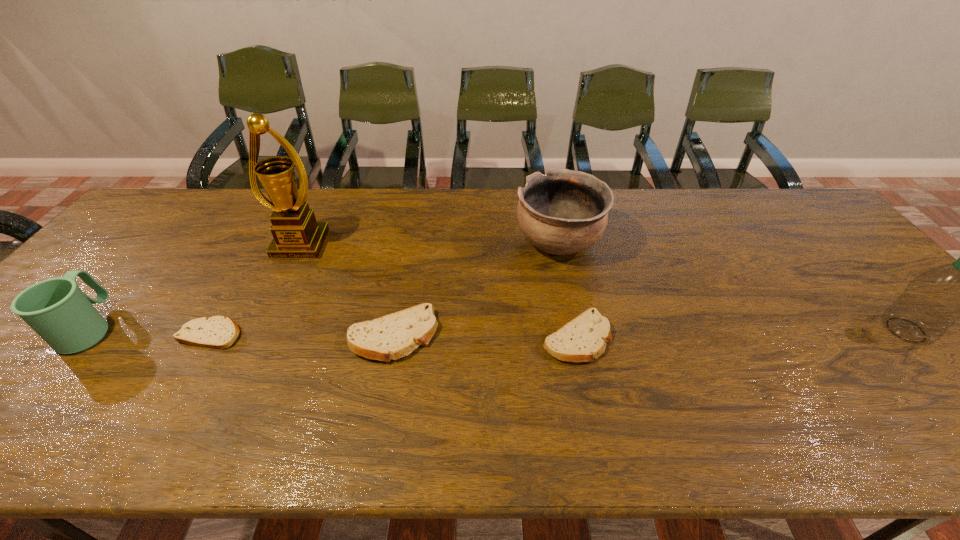
I want to click on vacant space that satisfies the following two spatial constraints: 1. on the front-facing side of the tallest object; 2. on the left side of the fifth tallest object, so click(257, 336).

You are a GUI agent. You are given a task and a screenshot of the screen. Output one action in this format:
    pyautogui.click(x=<x>, y=<y>)
    Task: Click on the vacant area in the image that satisfies the following two spatial constraints: 1. on the side of the pottery with the handle; 2. on the left side of the mug
    
    Given the screenshot: What is the action you would take?
    pyautogui.click(x=162, y=242)

Identify the location of vacant space that satisfies the following two spatial constraints: 1. on the side of the leftmost object with the handle; 2. on the right side of the pottery. The width and height of the screenshot is (960, 540). (162, 242).

Where is `blank area in the image that satisfies the following two spatial constraints: 1. on the side of the leftmost object with the handle; 2. on the left side of the third tallest object`? The height and width of the screenshot is (540, 960). blank area in the image that satisfies the following two spatial constraints: 1. on the side of the leftmost object with the handle; 2. on the left side of the third tallest object is located at coordinates (162, 242).